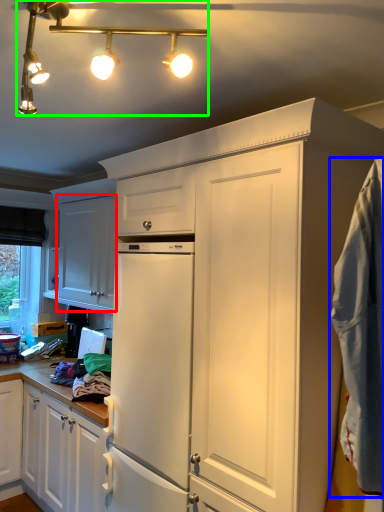
Question: Considering the real-world distances, which object is farthest from cabinetry (highlighted by a red box)? blanket (highlighted by a blue box) or light fixture (highlighted by a green box)?

Choices:
 (A) blanket
 (B) light fixture

Answer: (A)